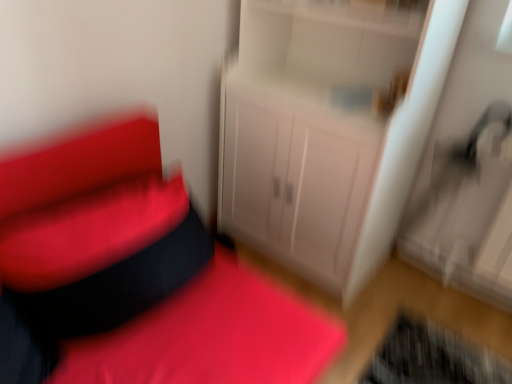
Question: Visually, is metallic silver swivel chair at right positioned to the left or to the right of matte white cabinet at center?

Choices:
 (A) right
 (B) left

Answer: (A)

Question: Choose the correct answer: Is metallic silver swivel chair at right inside matte white cabinet at center or outside it?

Choices:
 (A) outside
 (B) inside

Answer: (A)

Question: Estimate the real-world distances between objects in this image. Which object is farther from the matte white cabinet at center?

Choices:
 (A) metallic silver swivel chair at right
 (B) white glossy cabinet at center

Answer: (A)

Question: Estimate the real-world distances between objects in this image. Which object is closer to the metallic silver swivel chair at right?

Choices:
 (A) matte white cabinet at center
 (B) white glossy cabinet at center

Answer: (B)